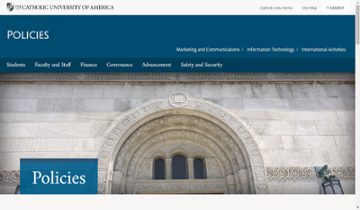
I want to click on window, so click(179, 164).